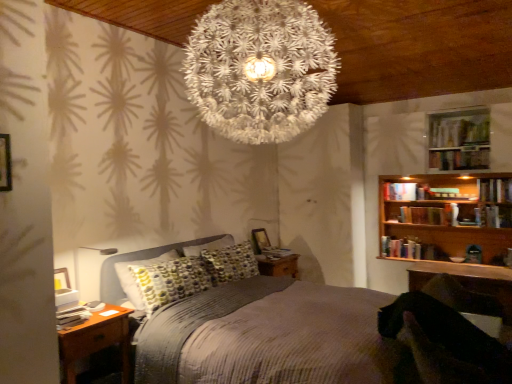
Question: Does hardcover book at center, which ranks as the sixth book in right-to-left order, appear on the left side of white paper-like at center?

Choices:
 (A) yes
 (B) no

Answer: (B)

Question: From the image's perspective, is hardcover book at center, which ranks as the sixth book in right-to-left order, located above white paper-like at center?

Choices:
 (A) no
 (B) yes

Answer: (A)

Question: Is hardcover book at center, which appears as the 1th book when viewed from the left, at the right side of white paper-like at center?

Choices:
 (A) no
 (B) yes

Answer: (B)

Question: Is hardcover book at center, the first book from the bottom, closer to the viewer compared to white paper-like at center?

Choices:
 (A) no
 (B) yes

Answer: (A)

Question: Is the depth of hardcover book at center, the first book from the bottom, greater than that of white paper-like at center?

Choices:
 (A) no
 (B) yes

Answer: (B)

Question: Is hardcover book at center, which ranks as the sixth book in right-to-left order, oriented towards white paper-like at center?

Choices:
 (A) no
 (B) yes

Answer: (A)

Question: Is hardcover book at upper right, the 5th book when ordered from left to right, not inside brown wood nightstand at lower left?

Choices:
 (A) no
 (B) yes

Answer: (B)

Question: Does hardcover book at upper right, the sixth book in the bottom-to-top sequence, have a greater width compared to brown wood nightstand at lower left?

Choices:
 (A) no
 (B) yes

Answer: (A)

Question: From the image's perspective, would you say hardcover book at upper right, which ranks as the second book in right-to-left order, is shown under brown wood nightstand at lower left?

Choices:
 (A) yes
 (B) no

Answer: (B)

Question: Considering the relative positions of hardcover book at upper right, which ranks as the second book in right-to-left order, and brown wood nightstand at lower left in the image provided, is hardcover book at upper right, which ranks as the second book in right-to-left order, to the right of brown wood nightstand at lower left from the viewer's perspective?

Choices:
 (A) yes
 (B) no

Answer: (A)

Question: From a real-world perspective, is hardcover book at upper right, which ranks as the second book in right-to-left order, positioned under brown wood nightstand at lower left based on gravity?

Choices:
 (A) no
 (B) yes

Answer: (A)

Question: Is hardcover book at upper right, the sixth book in the bottom-to-top sequence, closer to the viewer compared to brown wood nightstand at lower left?

Choices:
 (A) yes
 (B) no

Answer: (B)

Question: From a real-world perspective, is brown wood nightstand at lower left positioned over hardcover book at upper right, which ranks as the second book in right-to-left order, based on gravity?

Choices:
 (A) no
 (B) yes

Answer: (A)